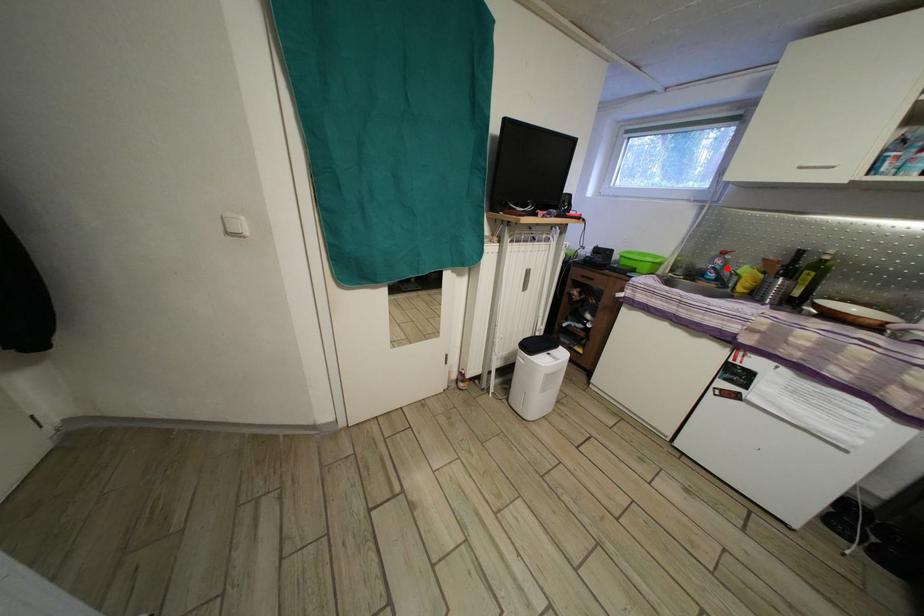
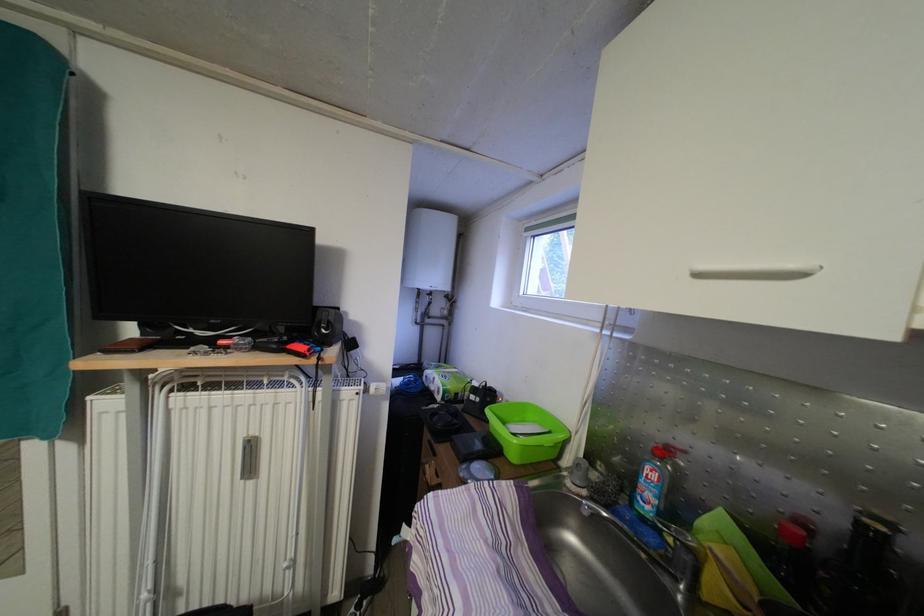
Locate, in the second image, the point that corresponds to the highlighted location in the first image.

(661, 484)